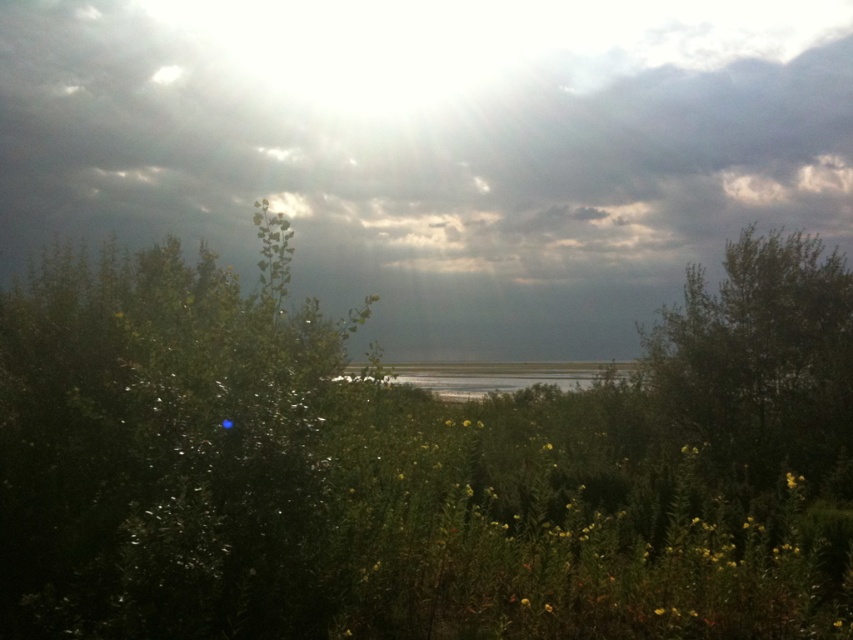
Consider the image. Is green leafy bush at left shorter than green leafy tree at right?

Correct, green leafy bush at left is not as tall as green leafy tree at right.

Measure the distance between point (51, 276) and camera.

6.86 meters

Does point (282, 550) lie in front of point (759, 280)?

Yes, point (282, 550) is in front of point (759, 280).

Where is `green leafy bush at left`? green leafy bush at left is located at coordinates (163, 448).

Who is higher up, gray cloudy sky at upper center or green leafy tree at right?

Positioned higher is gray cloudy sky at upper center.

Does gray cloudy sky at upper center come in front of green leafy tree at right?

No, gray cloudy sky at upper center is further to the viewer.

Locate an element on the screen. The height and width of the screenshot is (640, 853). gray cloudy sky at upper center is located at coordinates (434, 147).

The width and height of the screenshot is (853, 640). In order to click on green leafy bush at left in this screenshot , I will do `click(163, 448)`.

Consider the image. Does green leafy bush at left appear on the left side of green grassy lake at center?

Indeed, green leafy bush at left is positioned on the left side of green grassy lake at center.

I want to click on green leafy bush at left, so click(163, 448).

You are a GUI agent. You are given a task and a screenshot of the screen. Output one action in this format:
    pyautogui.click(x=<x>, y=<y>)
    Task: Click on the green leafy bush at left
    The width and height of the screenshot is (853, 640).
    Given the screenshot: What is the action you would take?
    pyautogui.click(x=163, y=448)